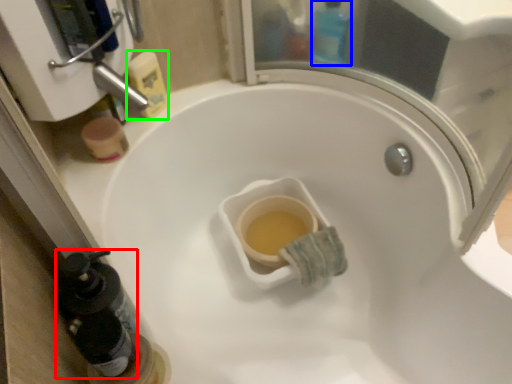
Question: Considering the real-world distances, which object is farthest from bottle (highlighted by a red box)? bottle (highlighted by a blue box) or cleaning product (highlighted by a green box)?

Choices:
 (A) bottle
 (B) cleaning product

Answer: (A)